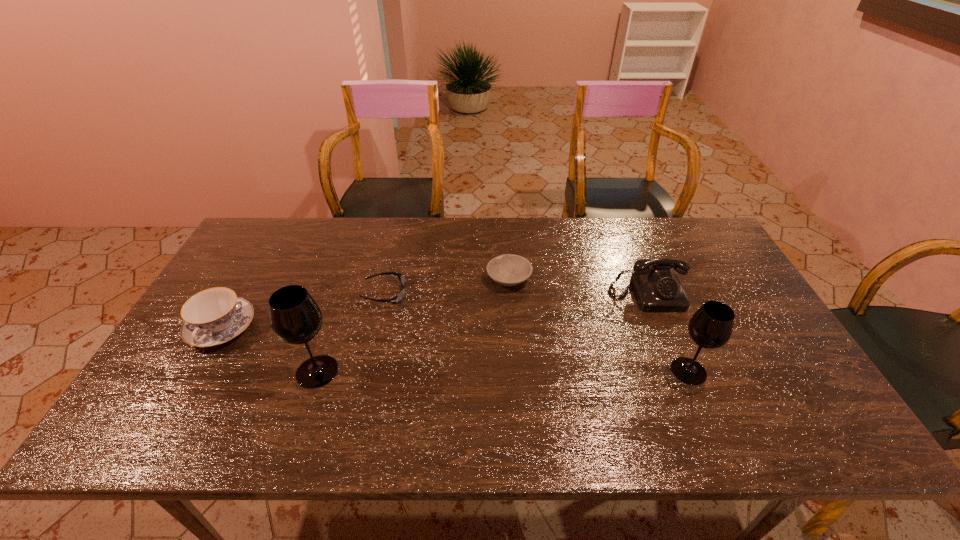
If equal spacing is desired by inserting an extra wineglass among them, please point out a free spot for this new wineglass. Please provide its 2D coordinates. Your answer should be formatted as a tuple, i.e. [(x, y)], where the tuple contains the x and y coordinates of a point satisfying the conditions above.

[(503, 371)]